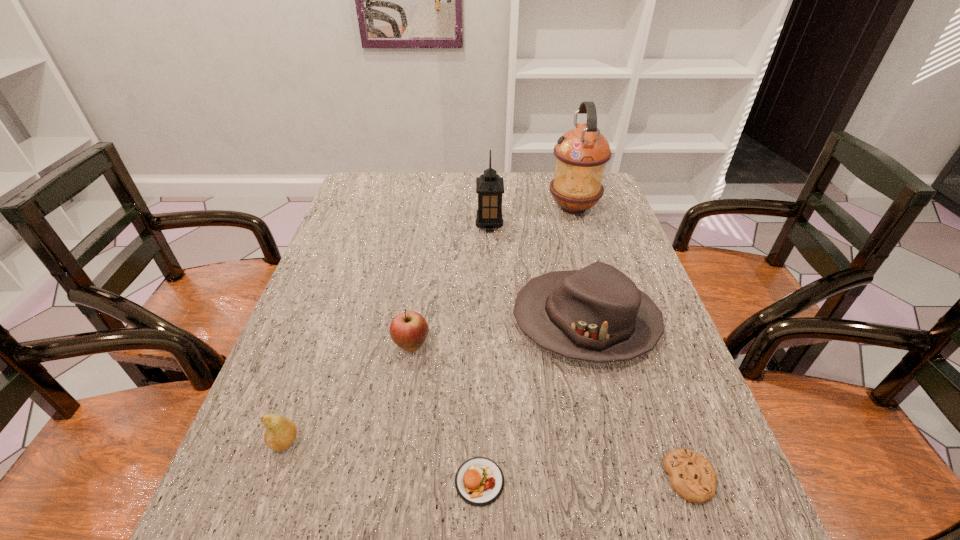
Where is `the tallest object`? the tallest object is located at coordinates (x=581, y=154).

I want to click on lantern, so click(489, 186).

At what (x,y) coordinates should I click in order to perform the action: click on the third tallest object. Please return your answer as a coordinate pair (x, y). Looking at the image, I should click on (597, 314).

Find the location of a particular element. This screenshot has height=540, width=960. apple is located at coordinates (408, 330).

Image resolution: width=960 pixels, height=540 pixels. I want to click on pear, so click(280, 433).

The width and height of the screenshot is (960, 540). What are the coordinates of `patty (food)` in the screenshot? It's located at (479, 481).

Image resolution: width=960 pixels, height=540 pixels. In order to click on cookie in this screenshot , I will do 692,476.

Locate an element on the screen. The width and height of the screenshot is (960, 540). vacant space located on the front of the tallest object is located at coordinates (589, 261).

Locate an element on the screen. The height and width of the screenshot is (540, 960). vacant space situated 0.160m on the front of the lantern is located at coordinates (491, 267).

Where is `free space located 0.170m on the decorative side of the hat`? free space located 0.170m on the decorative side of the hat is located at coordinates (443, 321).